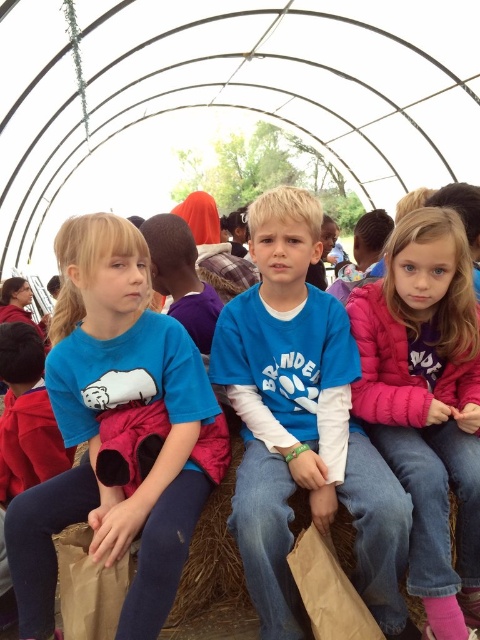
Is blue cotton shirt at center shorter than purple cotton shirt at center?

No, blue cotton shirt at center is not shorter than purple cotton shirt at center.

Which is behind, point (288, 416) or point (158, 276)?

Positioned behind is point (158, 276).

What do you see at coordinates (301, 424) in the screenshot? This screenshot has height=640, width=480. I see `blue cotton shirt at center` at bounding box center [301, 424].

The height and width of the screenshot is (640, 480). I want to click on blue cotton shirt at center, so click(301, 424).

Where is `brown paper bag at lower left`? brown paper bag at lower left is located at coordinates (87, 586).

Is brown paper bag at lower left wider than purple cotton shirt at center?

No, brown paper bag at lower left is not wider than purple cotton shirt at center.

The height and width of the screenshot is (640, 480). What do you see at coordinates (87, 586) in the screenshot?
I see `brown paper bag at lower left` at bounding box center [87, 586].

Identify the location of brown paper bag at lower left. This screenshot has height=640, width=480. (87, 586).

Is pink fleece jacket at center bigger than brown paper bag at center?

Indeed, pink fleece jacket at center has a larger size compared to brown paper bag at center.

Between pink fleece jacket at center and brown paper bag at center, which one has more height?

pink fleece jacket at center is taller.

The image size is (480, 640). I want to click on pink fleece jacket at center, so click(427, 403).